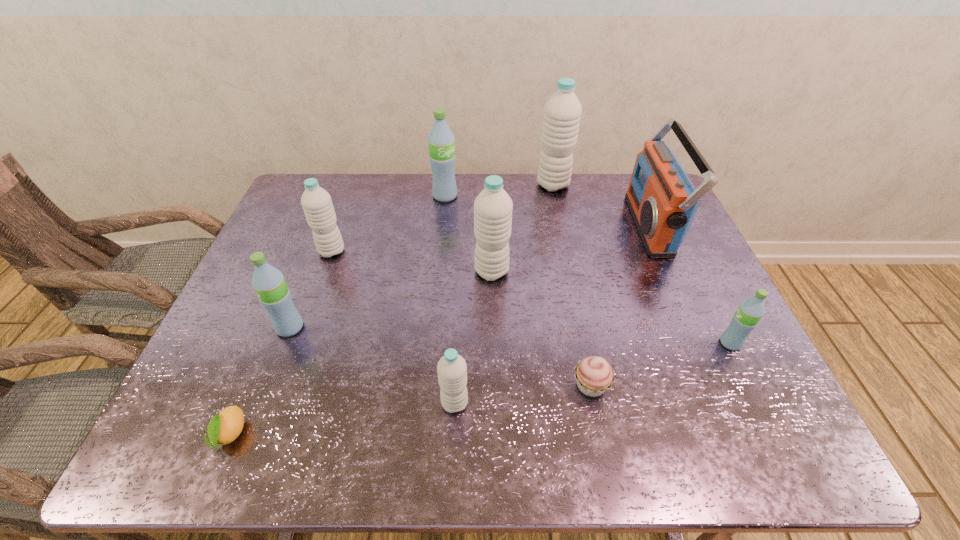
This screenshot has width=960, height=540. What are the coordinates of `vacant region located on the front-facing side of the radio receiver` in the screenshot? It's located at (575, 225).

The image size is (960, 540). I want to click on vacant region located 0.280m on the front-facing side of the radio receiver, so click(543, 225).

At what (x,y) coordinates should I click in order to perform the action: click on free space located 0.290m on the front-facing side of the radio receiver. Please return your answer as a coordinate pair (x, y). The width and height of the screenshot is (960, 540). Looking at the image, I should click on (540, 225).

The image size is (960, 540). Find the location of `vacant point located 0.240m on the front of the leftmost white water bottle`. vacant point located 0.240m on the front of the leftmost white water bottle is located at coordinates (305, 326).

This screenshot has height=540, width=960. What are the coordinates of `free spot located on the left of the second biggest green water bottle` in the screenshot? It's located at (232, 328).

The height and width of the screenshot is (540, 960). Find the location of `vacant space situated 0.260m on the front of the smallest green water bottle`. vacant space situated 0.260m on the front of the smallest green water bottle is located at coordinates (789, 462).

The image size is (960, 540). Find the location of `free location located 0.370m on the right of the nearest white water bottle`. free location located 0.370m on the right of the nearest white water bottle is located at coordinates click(x=640, y=403).

Locate an element on the screen. The height and width of the screenshot is (540, 960). vacant region located on the left of the pink cupcake is located at coordinates (413, 386).

The width and height of the screenshot is (960, 540). Identify the location of radio receiver located at the far edge. (662, 200).

Locate an element on the screen. Image resolution: width=960 pixels, height=540 pixels. object at the near edge is located at coordinates (226, 426).